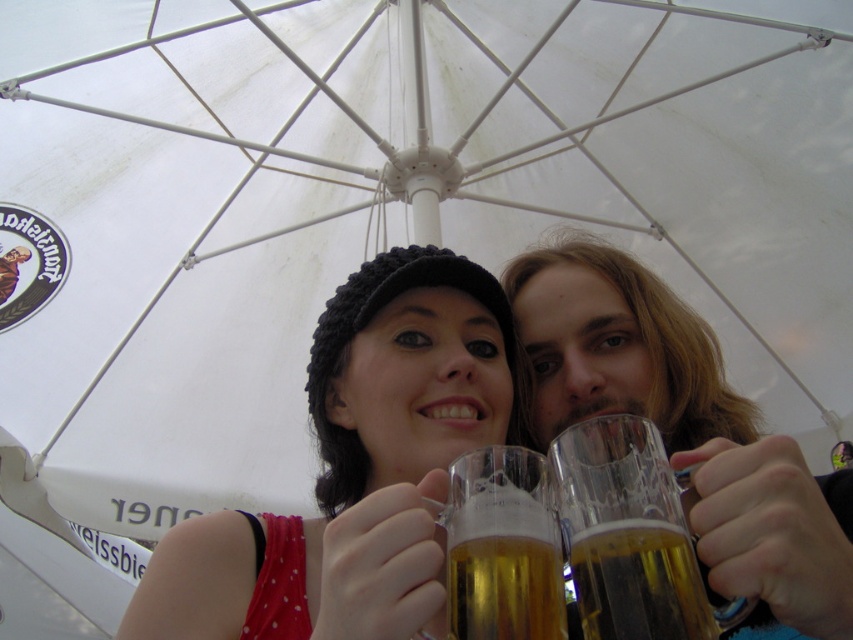
Question: Does transparent glass mug at center appear on the right side of translucent glass mug at center?

Choices:
 (A) yes
 (B) no

Answer: (A)

Question: Considering the relative positions of matte black beanie at center and transparent glass mug at center in the image provided, where is matte black beanie at center located with respect to transparent glass mug at center?

Choices:
 (A) left
 (B) right

Answer: (A)

Question: Which object is closer to the camera taking this photo?

Choices:
 (A) matte black beanie at center
 (B) translucent glass mug at center

Answer: (B)

Question: Which object appears farthest from the camera in this image?

Choices:
 (A) matte black beanie at center
 (B) golden glass mug at center
 (C) translucent glass mug at center

Answer: (A)

Question: Which object is positioned farthest from the translucent glass mug at center?

Choices:
 (A) transparent glass mug at center
 (B) matte black beanie at center
 (C) golden glass mug at center

Answer: (B)

Question: Where is translucent glass mug at upper right located in relation to translucent glass mug at center in the image?

Choices:
 (A) below
 (B) above

Answer: (B)